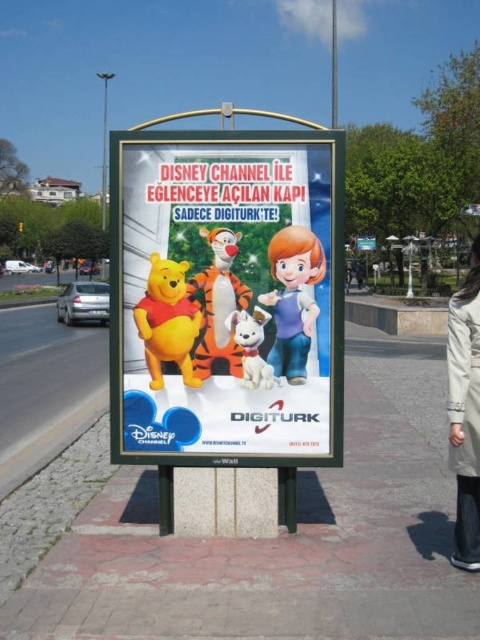
Which of these two, yellow matte winnie the pooh at center or orange plush tiger at center, stands taller?

Standing taller between the two is orange plush tiger at center.

Is the position of yellow matte winnie the pooh at center less distant than that of orange plush tiger at center?

No, yellow matte winnie the pooh at center is further to the viewer.

Locate an element on the screen. yellow matte winnie the pooh at center is located at coordinates (168, 321).

Does cobblestone pavement at center have a greater width compared to matte plastic poster at center?

Correct, the width of cobblestone pavement at center exceeds that of matte plastic poster at center.

Is point (432, 512) positioned before point (227, 268)?

No, it is behind (227, 268).

Where is `cobblestone pavement at center`? This screenshot has width=480, height=640. cobblestone pavement at center is located at coordinates (283, 538).

Who is positioned more to the right, cobblestone pavement at center or yellow matte winnie the pooh at center?

cobblestone pavement at center

Who is higher up, cobblestone pavement at center or yellow matte winnie the pooh at center?

yellow matte winnie the pooh at center

Locate an element on the screen. This screenshot has width=480, height=640. cobblestone pavement at center is located at coordinates (283, 538).